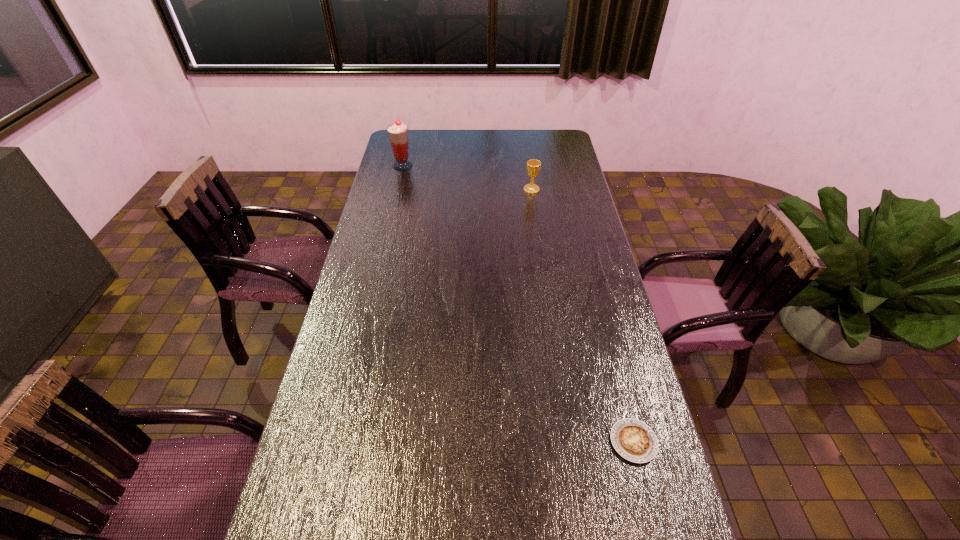
The width and height of the screenshot is (960, 540). I want to click on object present at the right edge, so click(x=635, y=441).

In the image, there is a desktop. In order to click on vacant area at the far edge in this screenshot , I will do `click(519, 137)`.

The height and width of the screenshot is (540, 960). In the image, there is a desktop. Identify the location of vacant space at the left edge. (421, 156).

Where is `free space at the right edge`? free space at the right edge is located at coordinates (596, 306).

At what (x,y) coordinates should I click in order to perform the action: click on vacant region at the far right corner of the desktop. Please return your answer as a coordinate pair (x, y). Image resolution: width=960 pixels, height=540 pixels. Looking at the image, I should click on (565, 152).

Locate an element on the screen. free space between the second object from right to left and the smoothie is located at coordinates (468, 178).

This screenshot has width=960, height=540. I want to click on vacant space that is in between the second object from left to right and the rightmost object, so pos(583,315).

This screenshot has width=960, height=540. Identify the location of vacant region between the shortest object and the farthest object. (518, 303).

Where is `free spot between the second object from left to right and the rightmost object`? free spot between the second object from left to right and the rightmost object is located at coordinates (583, 315).

This screenshot has width=960, height=540. I want to click on vacant space that is in between the second object from right to left and the tallest object, so click(x=468, y=178).